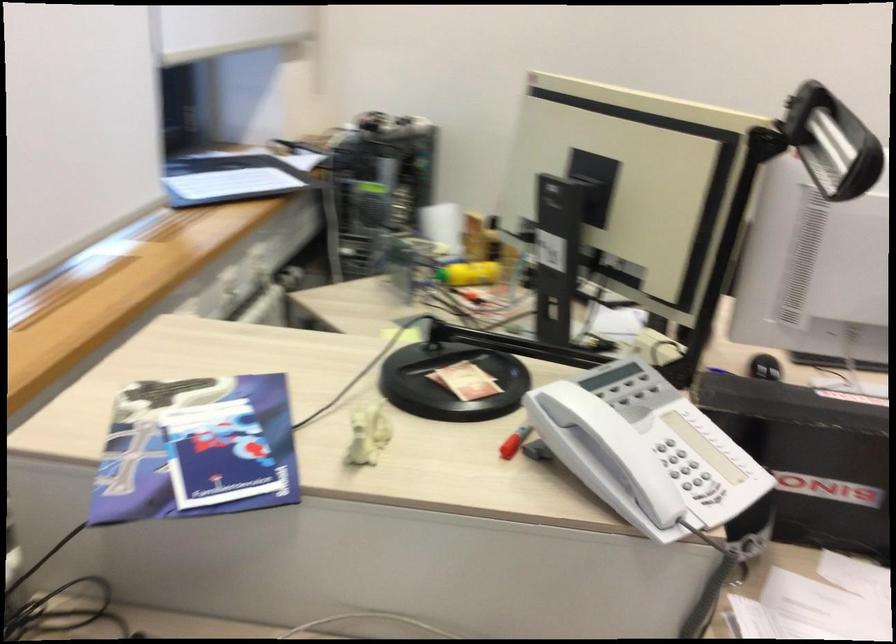
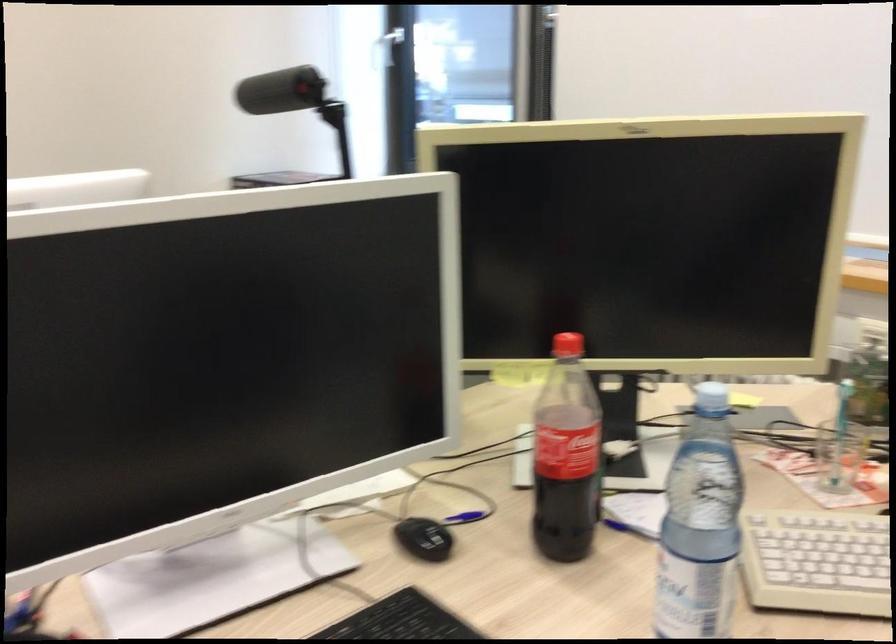
Find the pixel in the second image that matches point (511, 281) in the first image.

(839, 456)